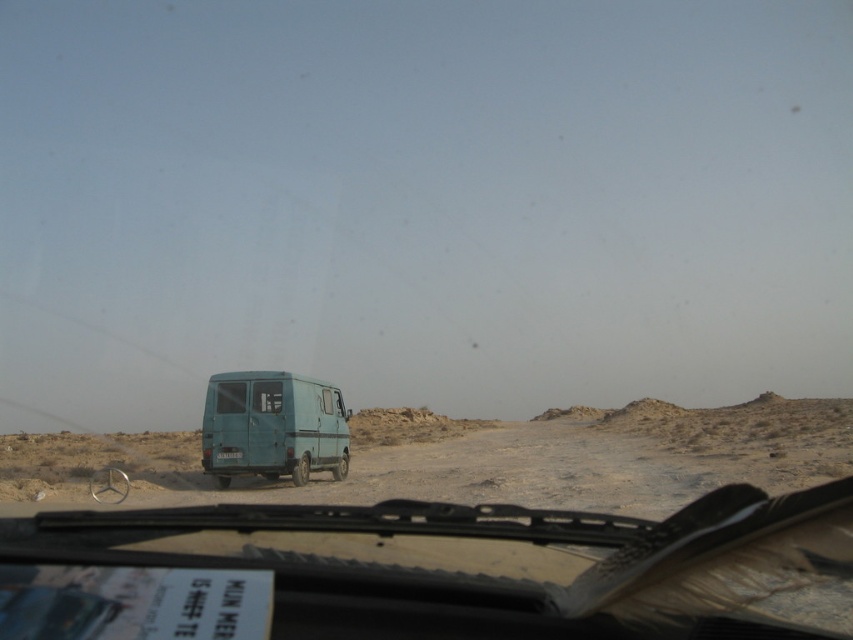
Question: Which object is closer to the camera taking this photo?

Choices:
 (A) blue matte van at center
 (B) teal matte van at center

Answer: (A)

Question: Which of the following is the farthest from the observer?

Choices:
 (A) (254, 424)
 (B) (363, 419)

Answer: (B)

Question: In this image, where is blue matte van at center located relative to teal matte van at center?

Choices:
 (A) left
 (B) right

Answer: (B)

Question: Can you confirm if blue matte van at center is thinner than teal matte van at center?

Choices:
 (A) no
 (B) yes

Answer: (A)

Question: Can you confirm if blue matte van at center is bigger than teal matte van at center?

Choices:
 (A) no
 (B) yes

Answer: (B)